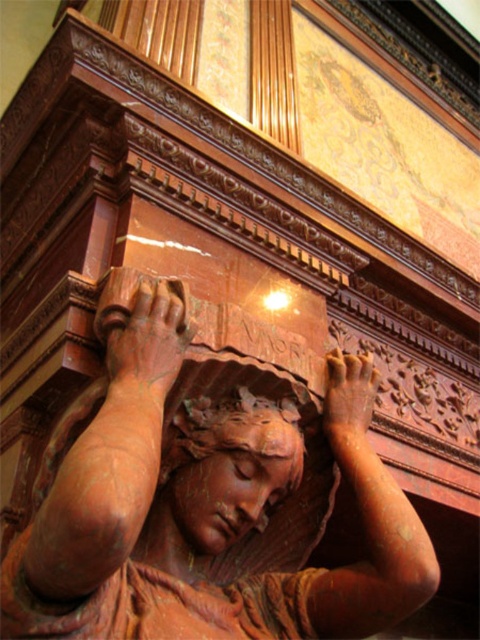
Question: Is rustic wood hand at center closer to camera compared to brown wood hand at center?

Choices:
 (A) yes
 (B) no

Answer: (A)

Question: Does rustic wood hand at center have a greater width compared to brown wood hand at center?

Choices:
 (A) yes
 (B) no

Answer: (A)

Question: Among these points, which one is farthest from the camera?

Choices:
 (A) (132, 323)
 (B) (68, 628)
 (C) (207, 422)

Answer: (C)

Question: Which object is the closest to the matte terracotta head at center?

Choices:
 (A) rustic wood hand at center
 (B) brown wood hand at center
 (C) rustic terracotta statue at center

Answer: (C)

Question: Can you confirm if rustic terracotta statue at center is wider than brown wood hand at center?

Choices:
 (A) yes
 (B) no

Answer: (A)

Question: Which point is farther from the camera taking this photo?

Choices:
 (A) (61, 424)
 (B) (228, 428)
 (C) (349, 428)
 (D) (145, 301)

Answer: (C)